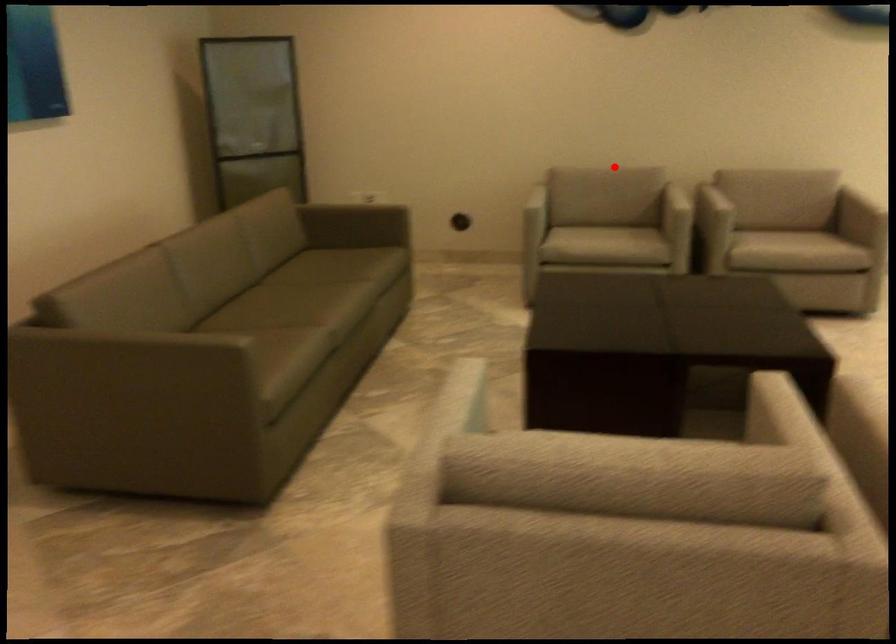
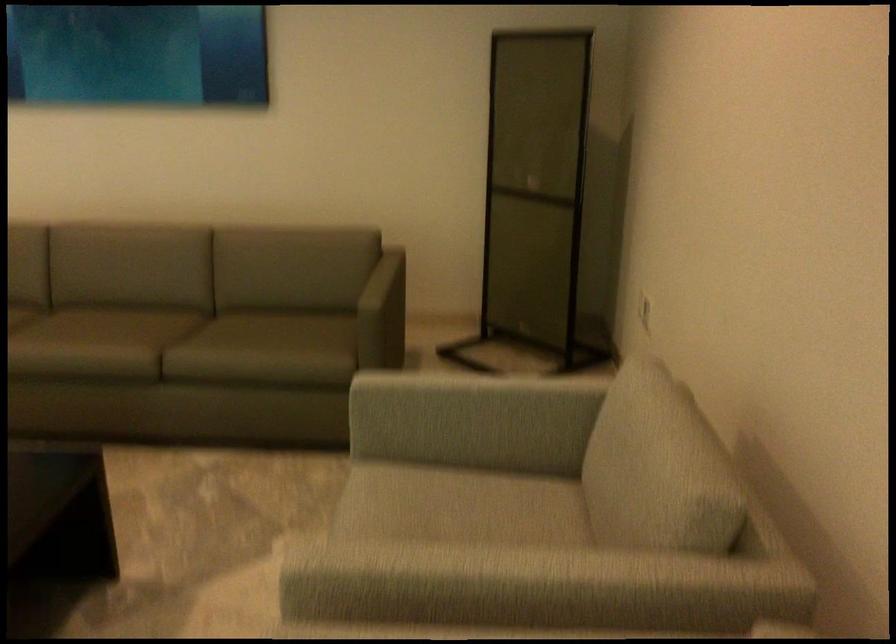
Question: I am providing you with two images of the same scene from different viewpoints. Given a red point in image1, look at the same physical point in image2. Is it:

Choices:
 (A) Closer to the viewpoint
 (B) Farther from the viewpoint

Answer: (A)